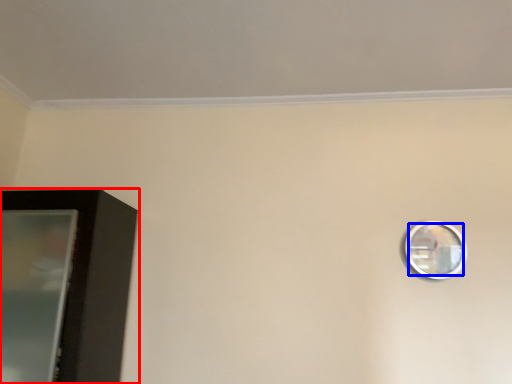
Question: Among these objects, which one is farthest to the camera, furniture (highlighted by a red box) or mirror (highlighted by a blue box)?

Choices:
 (A) furniture
 (B) mirror

Answer: (B)